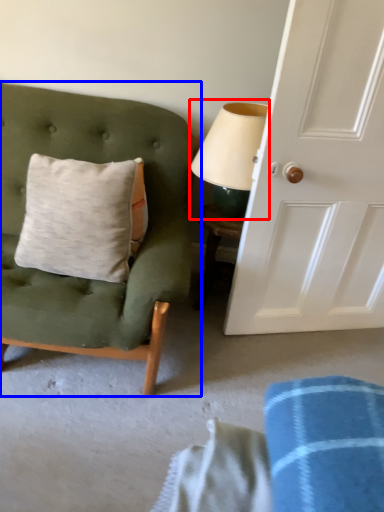
Question: Among these objects, which one is nearest to the camera, table lamp (highlighted by a red box) or chair (highlighted by a blue box)?

Choices:
 (A) table lamp
 (B) chair

Answer: (B)